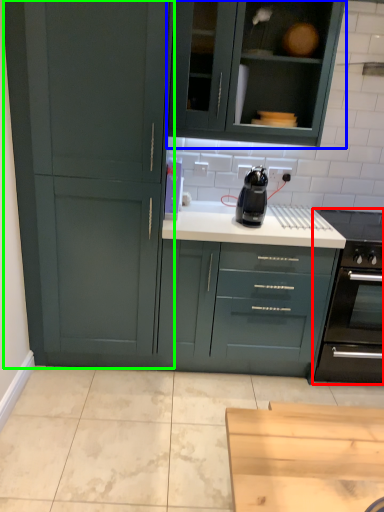
Question: Which object is positioned closest to home appliance (highlighted by a red box)? Select from cabinetry (highlighted by a blue box) and cupboard (highlighted by a green box).

Choices:
 (A) cabinetry
 (B) cupboard

Answer: (A)